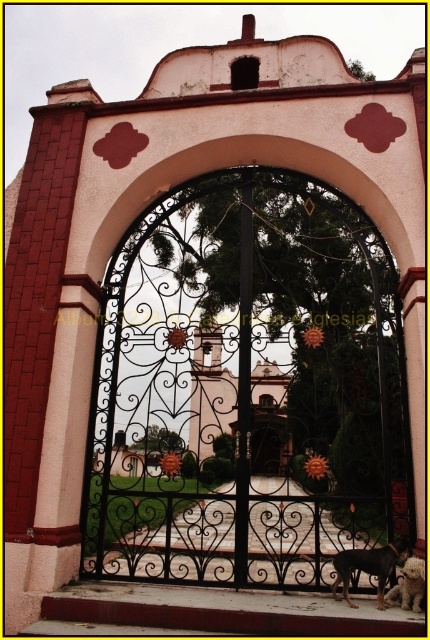
Between point (387, 557) and point (417, 602), which one is positioned behind?

Positioned behind is point (387, 557).

Find the location of a particular element. The image size is (430, 640). brown fur dog at center is located at coordinates (368, 566).

Locate an element on the screen. brown fur dog at center is located at coordinates (368, 566).

What do you see at coordinates (246, 388) in the screenshot? I see `black wrought iron gate at center` at bounding box center [246, 388].

Which is behind, point (405, 465) or point (401, 557)?

The point (405, 465) is behind.

Find the location of a particular element. The width and height of the screenshot is (430, 640). black wrought iron gate at center is located at coordinates (246, 388).

Is point (307, 502) less distant than point (414, 596)?

No, (307, 502) is further to viewer.

How distant is black wrought iron gate at center from white fluffy dog at lower right?

black wrought iron gate at center is 8.32 meters away from white fluffy dog at lower right.

Who is more distant from viewer, (122, 378) or (409, 595)?

Positioned behind is point (122, 378).

You are a GUI agent. You are given a task and a screenshot of the screen. Output one action in this format:
    pyautogui.click(x=<x>, y=<y>)
    Task: Click on the black wrought iron gate at center
    
    Given the screenshot: What is the action you would take?
    pyautogui.click(x=246, y=388)